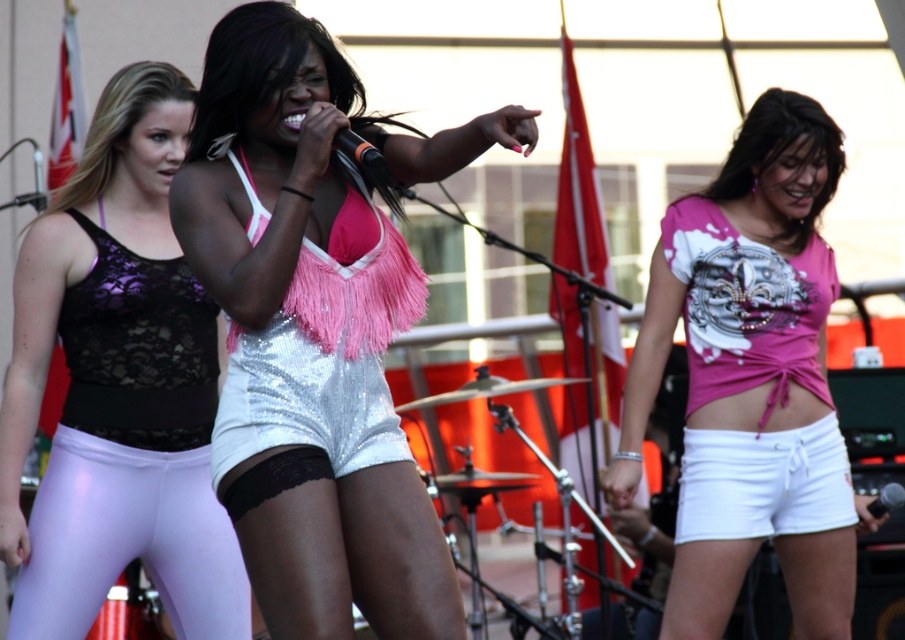
Question: Which of the following is the farthest from the observer?

Choices:
 (A) (439, 568)
 (B) (218, 598)
 (C) (754, 460)
 (D) (805, 301)

Answer: (D)

Question: Which object appears farthest from the camera in this image?

Choices:
 (A) sequined silver shorts at center
 (B) black matte microphone at center

Answer: (B)

Question: Observing the image, what is the correct spatial positioning of sequined silver shorts at center in reference to pink sequined bikini top at center?

Choices:
 (A) right
 (B) left

Answer: (A)

Question: Does sequined silver shorts at center appear on the left side of shiny purple leggings at left?

Choices:
 (A) no
 (B) yes

Answer: (A)

Question: Which object appears closest to the camera in this image?

Choices:
 (A) pink fabric top at center
 (B) lavender shiny leggings at left
 (C) shiny purple leggings at left

Answer: (C)

Question: Is sequined silver shorts at center positioned behind white lace shorts at lower right?

Choices:
 (A) yes
 (B) no

Answer: (B)